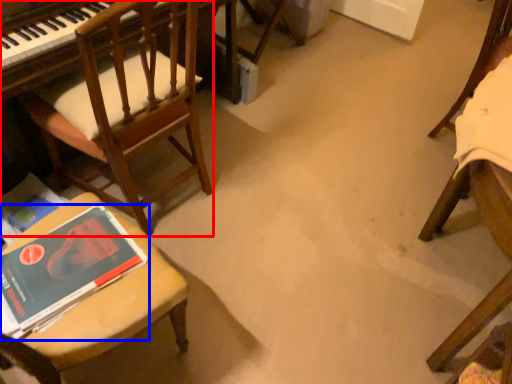
Question: Among these objects, which one is farthest to the camera, chair (highlighted by a red box) or book (highlighted by a blue box)?

Choices:
 (A) chair
 (B) book

Answer: (A)